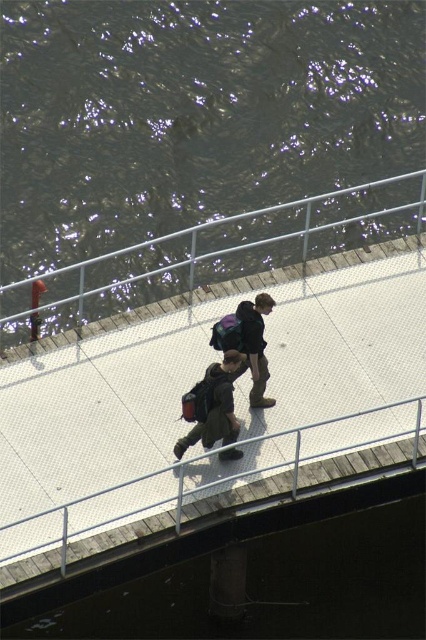
How far apart are transparent water at bridge center and metallic silver rail at center?

14.41 feet

Is point (249, 596) farther from viewer compared to point (331, 228)?

That is False.

Does point (166, 547) come in front of point (216, 288)?

Yes, it is.

Where is `transparent water at bridge center`? The image size is (426, 640). transparent water at bridge center is located at coordinates (258, 577).

Is white textured pavement at center further to the viewer compared to dark brown leather jacket at center?

No, white textured pavement at center is closer to the viewer.

Between white textured pavement at center and dark brown leather jacket at center, which one is positioned lower?

white textured pavement at center is below.

Is point (368, 244) positioned after point (242, 339)?

Yes, it is.

Locate an element on the screen. white textured pavement at center is located at coordinates (236, 397).

Who is more distant from viewer, (371,465) or (368,232)?

The point (368,232) is more distant.

Describe the element at coordinates (236, 397) in the screenshot. The width and height of the screenshot is (426, 640). I see `white textured pavement at center` at that location.

This screenshot has width=426, height=640. What are the coordinates of `white textured pavement at center` in the screenshot? It's located at (236, 397).

Image resolution: width=426 pixels, height=640 pixels. I want to click on white textured pavement at center, so click(x=236, y=397).